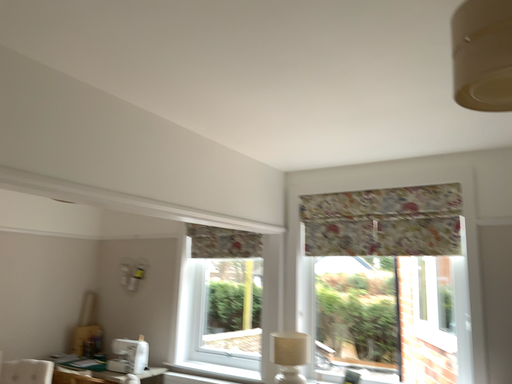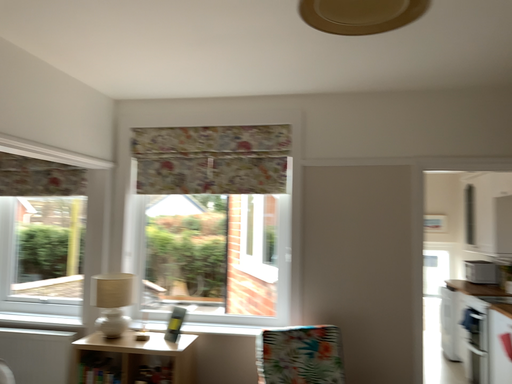
Question: Which way did the camera rotate in the video?

Choices:
 (A) rotated downward
 (B) rotated upward

Answer: (A)